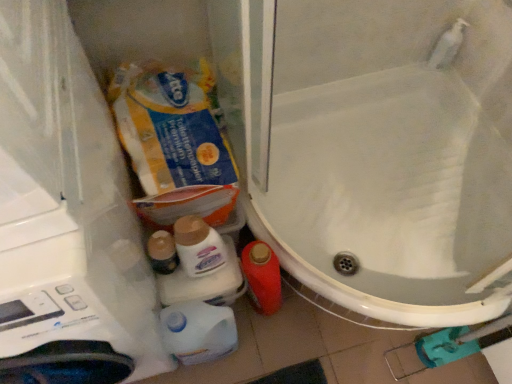
Question: Does white glossy bottle at lower center, which appears as the first cleaning product when ordered from the bottom, lie behind yellow cardboard toilet paper at upper left?

Choices:
 (A) yes
 (B) no

Answer: (A)

Question: Does white glossy bottle at lower center, which appears as the first cleaning product when ordered from the bottom, have a greater width compared to yellow cardboard toilet paper at upper left?

Choices:
 (A) yes
 (B) no

Answer: (B)

Question: Considering the relative sizes of white glossy bottle at lower center, which appears as the first cleaning product when ordered from the bottom, and yellow cardboard toilet paper at upper left in the image provided, is white glossy bottle at lower center, which appears as the first cleaning product when ordered from the bottom, bigger than yellow cardboard toilet paper at upper left?

Choices:
 (A) yes
 (B) no

Answer: (B)

Question: From a real-world perspective, is white glossy bottle at lower center, which ranks as the second cleaning product in top-to-bottom order, on top of yellow cardboard toilet paper at upper left?

Choices:
 (A) no
 (B) yes

Answer: (A)

Question: Is white glossy bottle at lower center, which ranks as the second cleaning product in top-to-bottom order, thinner than yellow cardboard toilet paper at upper left?

Choices:
 (A) yes
 (B) no

Answer: (A)

Question: Looking at the image, does white glossy bottle at lower center, which ranks as the second cleaning product in top-to-bottom order, seem bigger or smaller compared to yellow cardboard toilet paper at upper left?

Choices:
 (A) big
 (B) small

Answer: (B)

Question: Looking at their shapes, would you say white glossy bottle at lower center, which ranks as the second cleaning product in top-to-bottom order, is wider or thinner than yellow cardboard toilet paper at upper left?

Choices:
 (A) wide
 (B) thin

Answer: (B)

Question: Is white glossy bottle at lower center, which ranks as the second cleaning product in top-to-bottom order, situated inside yellow cardboard toilet paper at upper left or outside?

Choices:
 (A) outside
 (B) inside

Answer: (A)

Question: From the image's perspective, is white glossy bottle at lower center, which appears as the first cleaning product when ordered from the bottom, above or below yellow cardboard toilet paper at upper left?

Choices:
 (A) above
 (B) below

Answer: (B)

Question: From a real-world perspective, is matte plastic toiletries at center physically located above or below white glossy bottle at lower center, which appears as the first cleaning product when ordered from the bottom?

Choices:
 (A) above
 (B) below

Answer: (A)

Question: Looking at the image, does matte plastic toiletries at center seem bigger or smaller compared to white glossy bottle at lower center, which appears as the first cleaning product when ordered from the bottom?

Choices:
 (A) small
 (B) big

Answer: (A)

Question: Would you say matte plastic toiletries at center is to the left or to the right of white glossy bottle at lower center, which appears as the first cleaning product when ordered from the bottom, in the picture?

Choices:
 (A) right
 (B) left

Answer: (B)

Question: Do you think matte plastic toiletries at center is within white glossy bottle at lower center, which appears as the first cleaning product when ordered from the bottom, or outside of it?

Choices:
 (A) inside
 (B) outside

Answer: (B)

Question: Is yellow cardboard toilet paper at upper left to the left or to the right of matte plastic bottle at lower center, which is the 1th cleaning product in top-to-bottom order, in the image?

Choices:
 (A) right
 (B) left

Answer: (B)

Question: Is yellow cardboard toilet paper at upper left inside or outside of matte plastic bottle at lower center, which is the 1th cleaning product in top-to-bottom order?

Choices:
 (A) outside
 (B) inside

Answer: (A)